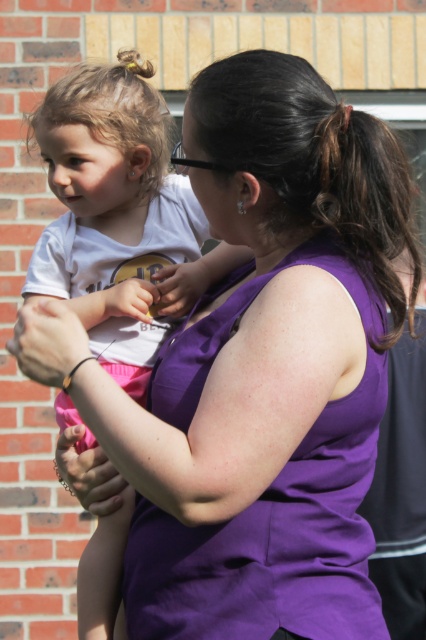
Question: Which of the following is the closest to the observer?

Choices:
 (A) (377, 177)
 (B) (80, 224)

Answer: (A)

Question: Does white matte shirt at left appear on the left side of dark brown hair at upper center?

Choices:
 (A) yes
 (B) no

Answer: (A)

Question: Is white matte shirt at left to the left of dark brown hair at upper center from the viewer's perspective?

Choices:
 (A) yes
 (B) no

Answer: (A)

Question: Which point is closer to the camera?

Choices:
 (A) (351, 132)
 (B) (100, 173)

Answer: (A)

Question: Is white matte shirt at left below dark brown hair at upper center?

Choices:
 (A) no
 (B) yes

Answer: (B)

Question: Which point is closer to the camera?

Choices:
 (A) dark brown hair at upper center
 (B) white matte shirt at left

Answer: (A)